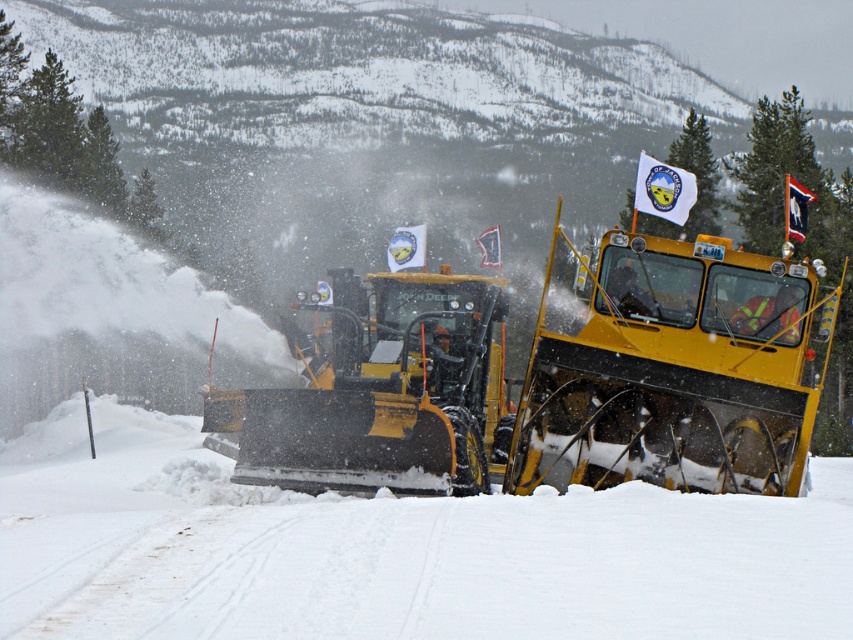
You are a maintenance worker assessing the snowplows. Which snowplow, the yellow matte snowplow at center or the yellow metal snowplow at center, has a greater height?

The yellow matte snowplow at center is taller than the yellow metal snowplow at center.